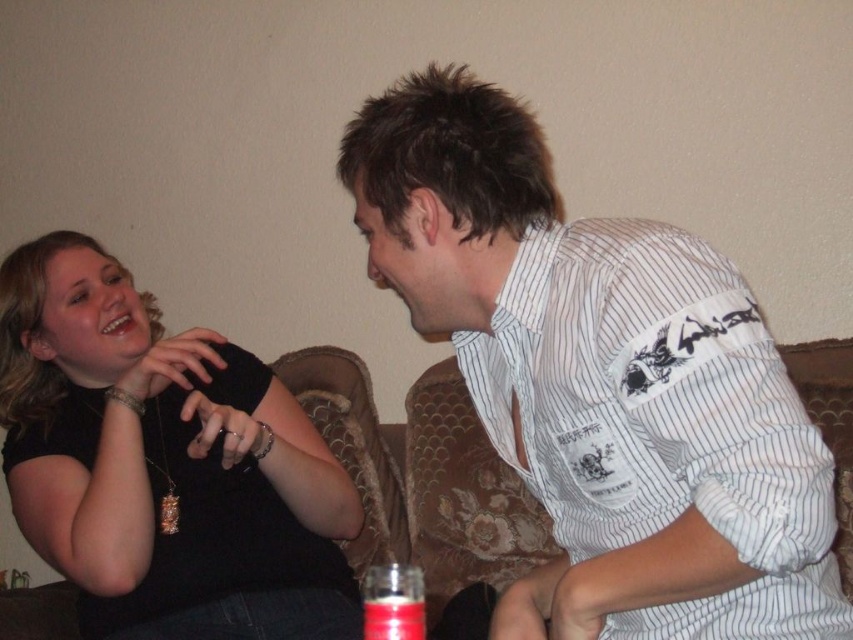
You are an interior designer analyzing the spatial arrangement of clothing items in the image. The white striped shirt at upper right is positioned at a specific coordinate. Can you determine its exact 2D location in the image?

The white striped shirt at upper right is located at the 2D coordinate point of (x=601, y=381).

You are a photographer taking a picture of the two people on the couch. You want to focus on the point closer to you. Which point should you focus on between point (825, 396) and point (380, 637)?

Point (380, 637) is closer to the camera than point (825, 396), so you should focus on point (380, 637).

You are taking a photo of two people sitting on a floral couch. You notice two points marked in the image at coordinates point (137, 520) and point (473, 497). Which point will appear larger in your photo?

Point (137, 520) will appear larger in the photo because it is closer to the camera than point (473, 497).